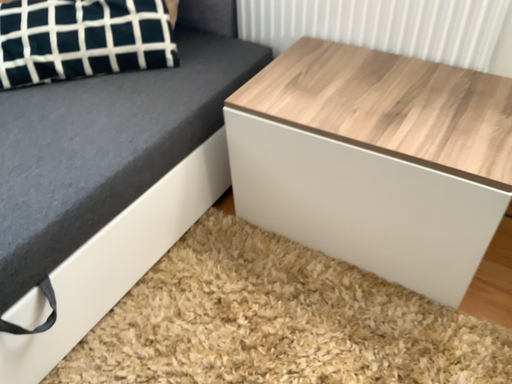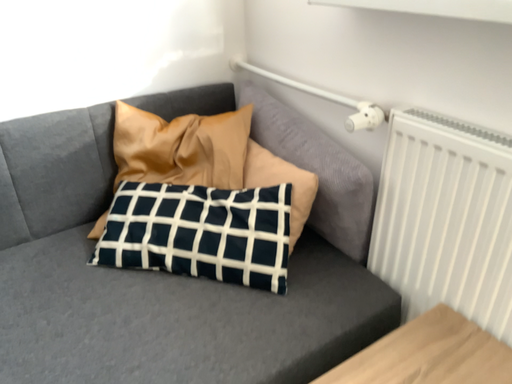
Question: Which way did the camera rotate in the video?

Choices:
 (A) rotated downward
 (B) rotated upward

Answer: (B)